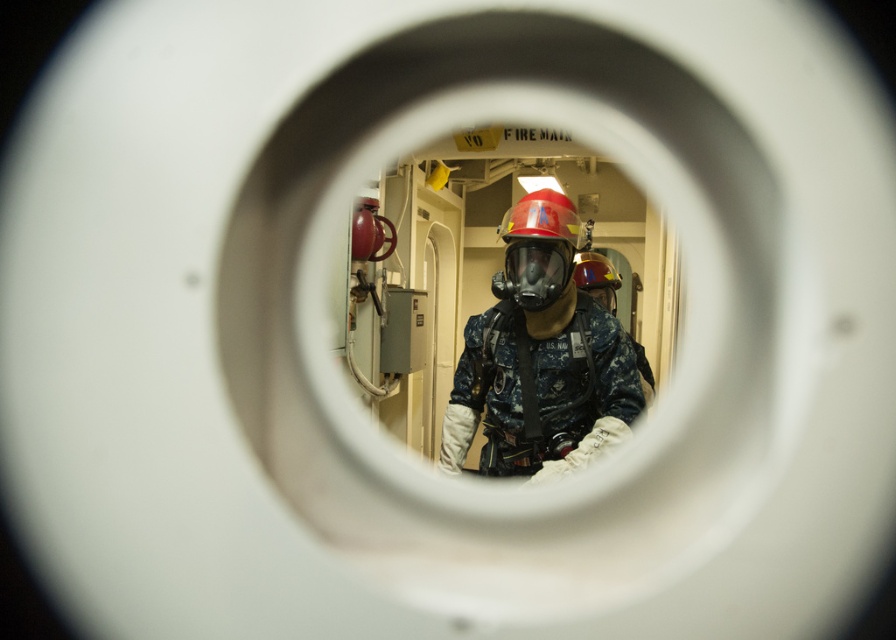
You are an emergency responder in a similar situation. You need to quickly identify which object is bigger between the blue camouflage uniform at center and the matte black helmet at center. Which one is larger?

The blue camouflage uniform at center is larger in size than the matte black helmet at center.

You are a safety inspector standing 1.5 meters away from the blue camouflage uniform at center. Can you safely reach it without moving closer?

The blue camouflage uniform at center is 1.74 meters from the viewer, so you are currently 1.5 meters away. Since you are closer than the object, you can safely reach it without moving closer.

You are a firefighter in a dark blue uniform with a red helmet. You need to locate your partner who is wearing a similar uniform but is partially hidden behind you. Where should you look relative to your position at point (538, 248)?

Your partner is partially obscured by you, so you should look behind your position at point (538, 248) to find them.